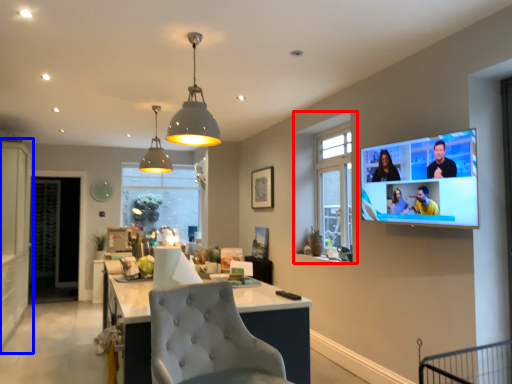
Question: Among these objects, which one is nearest to the camera, window (highlighted by a red box) or cabinetry (highlighted by a blue box)?

Choices:
 (A) window
 (B) cabinetry

Answer: (A)